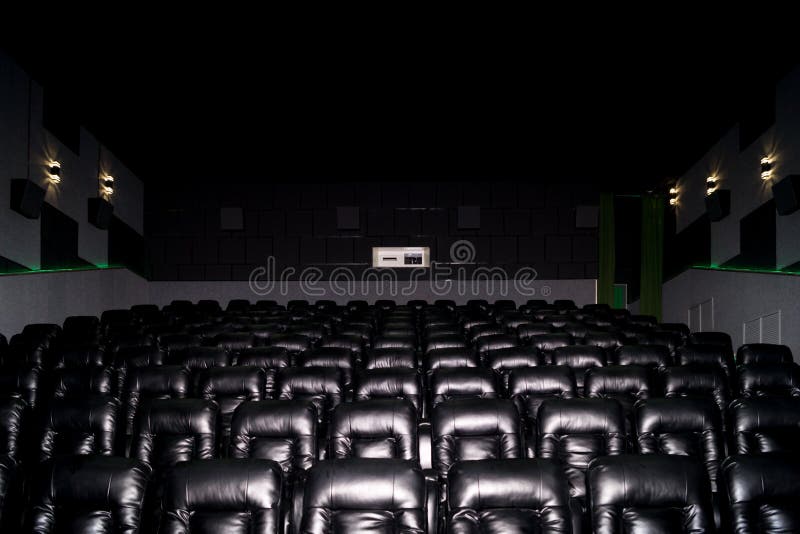
Find the location of a particular element. The width and height of the screenshot is (800, 534). movie seats in the front row of image is located at coordinates (750, 484), (632, 485), (510, 485), (365, 488), (240, 488), (105, 480).